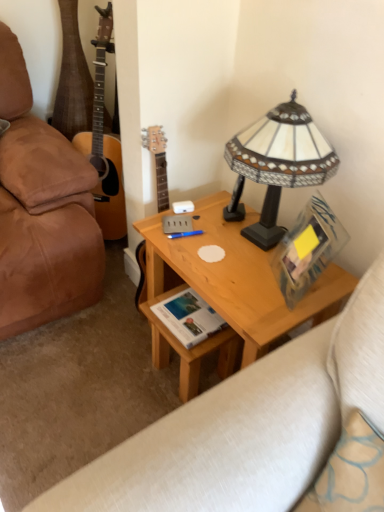
Question: From a real-world perspective, relative to leather studio couch at lower left, is blue plastic pen at center vertically above or below?

Choices:
 (A) above
 (B) below

Answer: (A)

Question: From the image's perspective, is blue plastic pen at center located above or below leather studio couch at lower left?

Choices:
 (A) above
 (B) below

Answer: (A)

Question: Considering the real-world distances, which object is closest to the leather studio couch at lower left?

Choices:
 (A) light wood desk at center
 (B) white paper book at center
 (C) blue plastic pen at center
 (D) stained glass lampshade at upper right

Answer: (A)

Question: Which of these objects is positioned closest to the blue plastic pen at center?

Choices:
 (A) white paper book at center
 (B) leather studio couch at lower left
 (C) light wood desk at center
 (D) stained glass lampshade at upper right

Answer: (A)